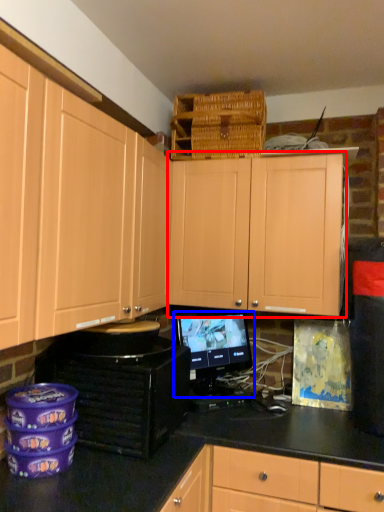
Question: Which of the following is the closest to the observer, cabinetry (highlighted by a red box) or computer monitor (highlighted by a blue box)?

Choices:
 (A) cabinetry
 (B) computer monitor

Answer: (A)